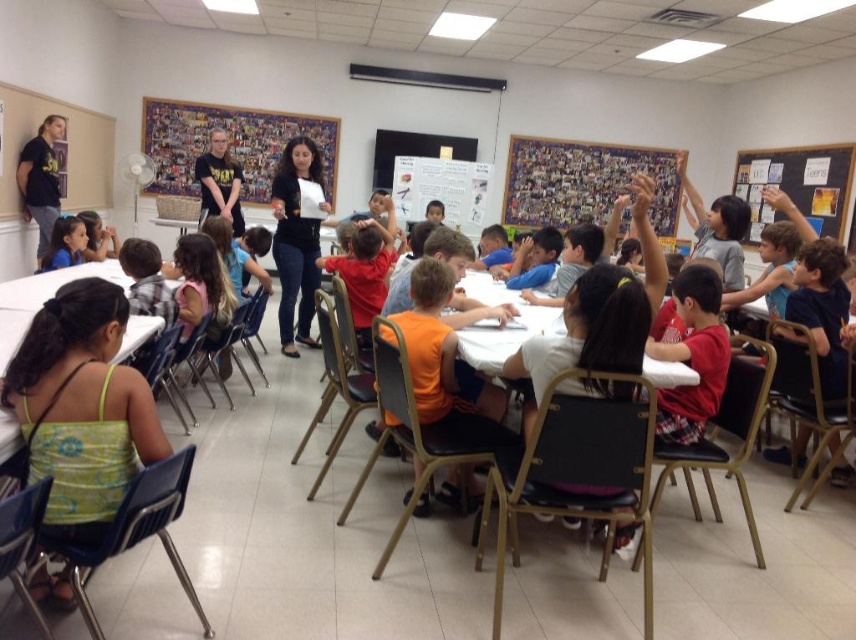
Can you confirm if blackboard at upper right is smaller than black t-shirt at upper left?

No, blackboard at upper right is not smaller than black t-shirt at upper left.

Is blackboard at upper right further to camera compared to black t-shirt at upper left?

Yes.

Is point (783, 179) farther from camera compared to point (54, 184)?

Yes.

The height and width of the screenshot is (640, 856). I want to click on blackboard at upper right, so click(797, 182).

Who is taller, collage paper collage at upper center or matte blue shirt at lower left?

collage paper collage at upper center is taller.

Can you confirm if collage paper collage at upper center is wider than matte blue shirt at lower left?

Indeed, collage paper collage at upper center has a greater width compared to matte blue shirt at lower left.

Between point (551, 220) and point (45, 268), which one is positioned in front?

Point (45, 268) is more forward.

Find the location of `collage paper collage at upper center`. collage paper collage at upper center is located at coordinates (583, 180).

Which is above, collage paper collage at upper center or matte black shirt at upper center?

Positioned higher is collage paper collage at upper center.

Consider the image. Is collage paper collage at upper center smaller than matte black shirt at upper center?

No, collage paper collage at upper center is not smaller than matte black shirt at upper center.

I want to click on collage paper collage at upper center, so click(x=583, y=180).

The width and height of the screenshot is (856, 640). What are the coordinates of `collage paper collage at upper center` in the screenshot? It's located at (583, 180).